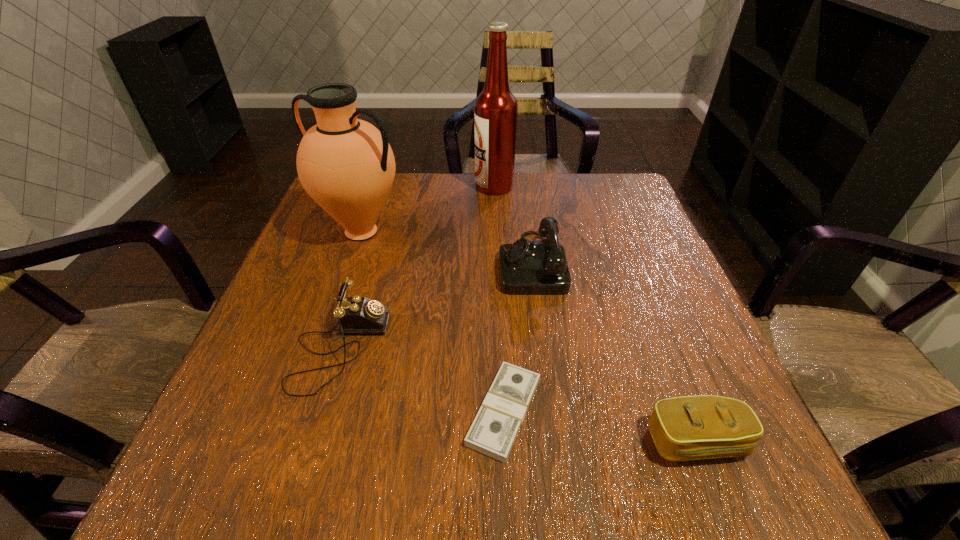
At what (x,y) coordinates should I click in order to perform the action: click on clutch bag situated at the near edge. Please return your answer as a coordinate pair (x, y). This screenshot has width=960, height=540. Looking at the image, I should click on (684, 428).

Locate an element on the screen. The height and width of the screenshot is (540, 960). dollar present at the near edge is located at coordinates (493, 432).

The image size is (960, 540). Find the location of `pitcher that is at the left edge`. pitcher that is at the left edge is located at coordinates (347, 166).

Where is `telephone that is positioned at the left edge`? The width and height of the screenshot is (960, 540). telephone that is positioned at the left edge is located at coordinates pyautogui.click(x=357, y=315).

Locate an element on the screen. object that is at the right edge is located at coordinates (684, 428).

This screenshot has width=960, height=540. I want to click on object at the far left corner, so click(347, 166).

The width and height of the screenshot is (960, 540). Find the location of `object that is positioned at the near right corner`. object that is positioned at the near right corner is located at coordinates (684, 428).

You are a GUI agent. You are given a task and a screenshot of the screen. Output one action in this format:
    pyautogui.click(x=<x>, y=<y>)
    Task: Click on the vacant space at the far edge of the desktop
    The height and width of the screenshot is (540, 960).
    Given the screenshot: What is the action you would take?
    pyautogui.click(x=407, y=180)

The width and height of the screenshot is (960, 540). In the image, there is a desktop. In order to click on vacant region at the near edge in this screenshot , I will do `click(396, 475)`.

The image size is (960, 540). Identify the location of vacant area at the left edge. (326, 259).